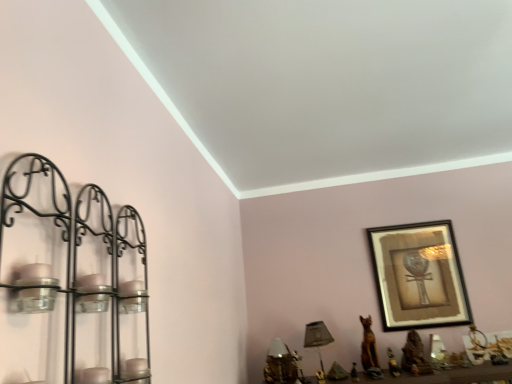
Question: From the image's perspective, is gold metallic table lamp at lower center, positioned as the 2th table lamp in right-to-left order, positioned above or below green fabric table lamp at lower center, the 1th table lamp in the right-to-left sequence?

Choices:
 (A) below
 (B) above

Answer: (A)

Question: Is point (285, 352) positioned closer to the camera than point (325, 327)?

Choices:
 (A) farther
 (B) closer

Answer: (A)

Question: Based on their relative distances, which object is nearer to the green fabric table lamp at lower center, which is the second table lamp in left-to-right order?

Choices:
 (A) gold metallic table lamp at lower center, positioned as the 2th table lamp in right-to-left order
 (B) wooden framed picture at upper right
 (C) black metal candle holder at left

Answer: (A)

Question: Which object is positioned farthest from the wooden framed picture at upper right?

Choices:
 (A) black metal candle holder at left
 (B) gold metallic table lamp at lower center, positioned as the 2th table lamp in right-to-left order
 (C) green fabric table lamp at lower center, which is the second table lamp in left-to-right order

Answer: (A)